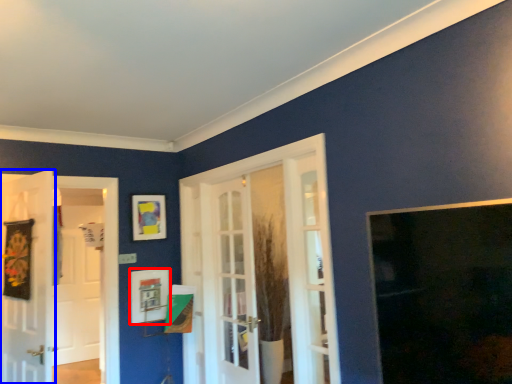
Question: Among these objects, which one is nearest to the camera, picture frame (highlighted by a red box) or door (highlighted by a blue box)?

Choices:
 (A) picture frame
 (B) door

Answer: (B)